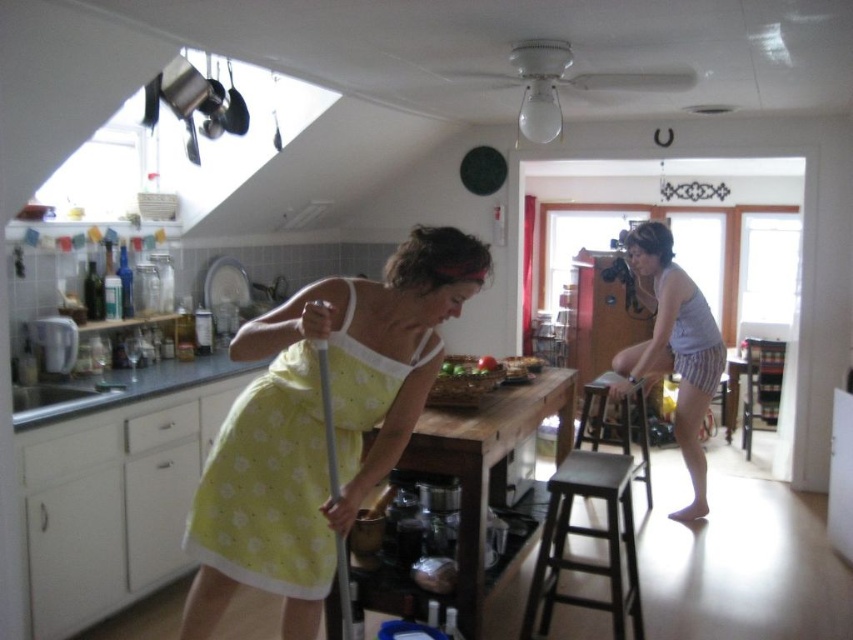
Which is below, gray cotton tank top at center or wooden stool at center?

wooden stool at center is below.

Is gray cotton tank top at center further to camera compared to wooden stool at center?

That is False.

This screenshot has height=640, width=853. Identify the location of gray cotton tank top at center. (672, 349).

You are a GUI agent. You are given a task and a screenshot of the screen. Output one action in this format:
    pyautogui.click(x=<x>, y=<y>)
    Task: Click on the gray cotton tank top at center
    The height and width of the screenshot is (640, 853).
    Given the screenshot: What is the action you would take?
    pyautogui.click(x=672, y=349)

Which is above, gray cotton tank top at center or dark brown wooden stool at lower center?

Positioned higher is gray cotton tank top at center.

Based on the photo, can you confirm if gray cotton tank top at center is bigger than dark brown wooden stool at lower center?

Yes.

Does point (689, 436) come in front of point (614, 604)?

No, (689, 436) is further to viewer.

Where is `gray cotton tank top at center`? This screenshot has width=853, height=640. gray cotton tank top at center is located at coordinates (672, 349).

Is point (665, 344) positioned after point (596, 432)?

No, it is not.

Where is `gray striped apron at right`? The image size is (853, 640). gray striped apron at right is located at coordinates (692, 336).